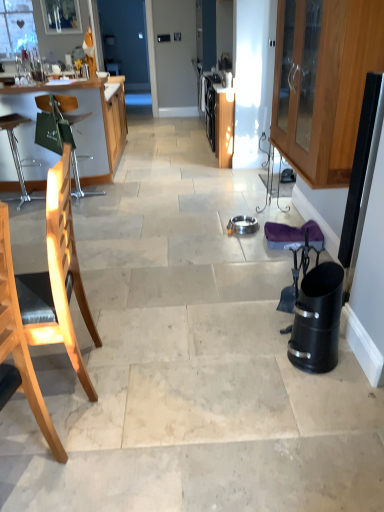
Question: Can we say matte glass window screen at upper left lies outside black plastic swivel chair at right?

Choices:
 (A) yes
 (B) no

Answer: (A)

Question: Is matte glass window screen at upper left in front of black plastic swivel chair at right?

Choices:
 (A) no
 (B) yes

Answer: (A)

Question: From a real-world perspective, does matte glass window screen at upper left stand above black plastic swivel chair at right?

Choices:
 (A) no
 (B) yes

Answer: (B)

Question: Considering the relative sizes of matte glass window screen at upper left and black plastic swivel chair at right in the image provided, is matte glass window screen at upper left shorter than black plastic swivel chair at right?

Choices:
 (A) yes
 (B) no

Answer: (A)

Question: From the image's perspective, is matte glass window screen at upper left beneath black plastic swivel chair at right?

Choices:
 (A) yes
 (B) no

Answer: (B)

Question: Is black plastic swivel chair at right at the back of matte glass window screen at upper left?

Choices:
 (A) no
 (B) yes

Answer: (A)

Question: Can you confirm if light wood chair at left, the second chair positioned from the front, is shorter than light wood chair at left, the 1th chair when ordered from front to back?

Choices:
 (A) yes
 (B) no

Answer: (A)

Question: Is light wood chair at left, which is the third chair from back to front, located within light wood chair at left, the second chair positioned from the front?

Choices:
 (A) no
 (B) yes

Answer: (A)

Question: Is light wood chair at left, positioned as the 2th chair in back-to-front order, not inside light wood chair at left, the 1th chair when ordered from front to back?

Choices:
 (A) yes
 (B) no

Answer: (A)

Question: Does light wood chair at left, the second chair positioned from the front, turn towards light wood chair at left, which is the third chair from back to front?

Choices:
 (A) no
 (B) yes

Answer: (A)

Question: Is light wood chair at left, the second chair positioned from the front, taller than light wood chair at left, which is the third chair from back to front?

Choices:
 (A) yes
 (B) no

Answer: (B)

Question: Is the depth of light wood chair at left, positioned as the 2th chair in back-to-front order, less than that of light wood chair at left, which is the third chair from back to front?

Choices:
 (A) yes
 (B) no

Answer: (B)

Question: Is wooden chair at left, which is counted as the first chair, starting from the back, shorter than black plastic trash can at right?

Choices:
 (A) no
 (B) yes

Answer: (A)